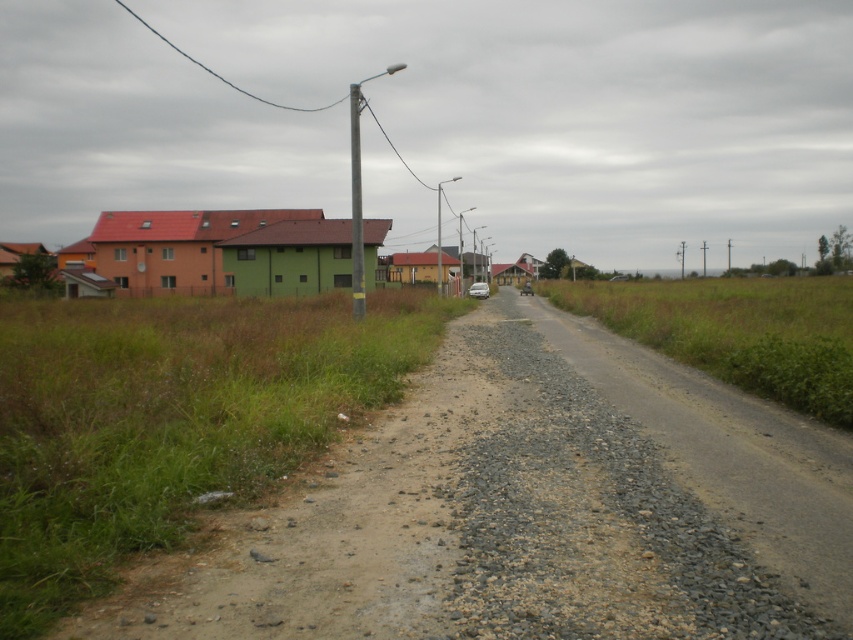
Describe the element at coordinates (357, 205) in the screenshot. I see `metallic gray pole at center` at that location.

Does metallic gray pole at center come in front of silver metallic car at center?

Yes, it is.

Is point (357, 125) farther from viewer compared to point (480, 284)?

Yes, it is.

This screenshot has width=853, height=640. In order to click on metallic gray pole at center in this screenshot , I will do `click(357, 205)`.

Can you confirm if brown gravel dirt track at center is positioned to the right of metallic gray pole at center?

Indeed, brown gravel dirt track at center is positioned on the right side of metallic gray pole at center.

Does brown gravel dirt track at center have a greater width compared to metallic gray pole at center?

Incorrect, brown gravel dirt track at center's width does not surpass metallic gray pole at center's.

You are a GUI agent. You are given a task and a screenshot of the screen. Output one action in this format:
    pyautogui.click(x=<x>, y=<y>)
    Task: Click on the brown gravel dirt track at center
    This screenshot has width=853, height=640.
    Given the screenshot: What is the action you would take?
    pyautogui.click(x=531, y=509)

Which is behind, point (619, 477) or point (519, 291)?

Point (519, 291)

Between brown gravel dirt track at center and matte silver car at center, which one is positioned higher?

matte silver car at center is above.

The image size is (853, 640). Describe the element at coordinates (531, 509) in the screenshot. I see `brown gravel dirt track at center` at that location.

I want to click on brown gravel dirt track at center, so click(531, 509).